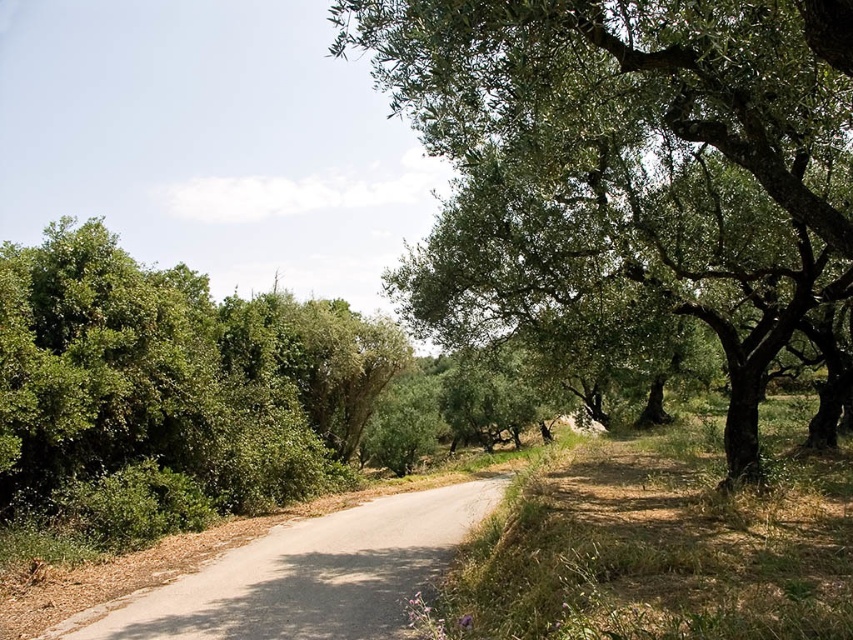
Can you confirm if green leafy tree at center is positioned to the left of gray asphalt road at center?

No, green leafy tree at center is not to the left of gray asphalt road at center.

Is green leafy tree at center closer to the viewer compared to gray asphalt road at center?

Yes, it is in front of gray asphalt road at center.

Between point (772, 61) and point (300, 572), which one is positioned in front?

Positioned in front is point (772, 61).

At what (x,y) coordinates should I click in order to perform the action: click on green leafy tree at center. Please return your answer as a coordinate pair (x, y). The width and height of the screenshot is (853, 640). Looking at the image, I should click on (630, 161).

Can you confirm if green leafy bush at left is wider than gray asphalt road at center?

Correct, the width of green leafy bush at left exceeds that of gray asphalt road at center.

Between green leafy bush at left and gray asphalt road at center, which one has less height?

gray asphalt road at center

Does point (241, 472) lie in front of point (399, 580)?

No.

Find the location of a particular element. green leafy bush at left is located at coordinates (172, 381).

Is green leafy tree at center to the left of green leafy bush at left from the viewer's perspective?

No, green leafy tree at center is not to the left of green leafy bush at left.

Is point (846, 100) closer to viewer compared to point (21, 392)?

Yes, point (846, 100) is closer to viewer.

Locate an element on the screen. The image size is (853, 640). green leafy tree at center is located at coordinates (630, 161).